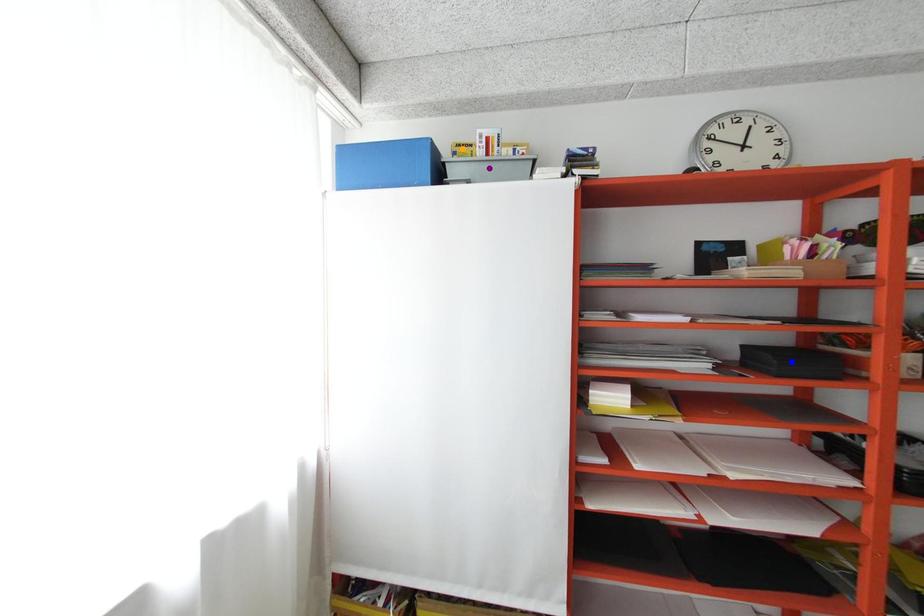
Order these from farthest to nearest:
orange point | blue point | purple point

1. orange point
2. purple point
3. blue point